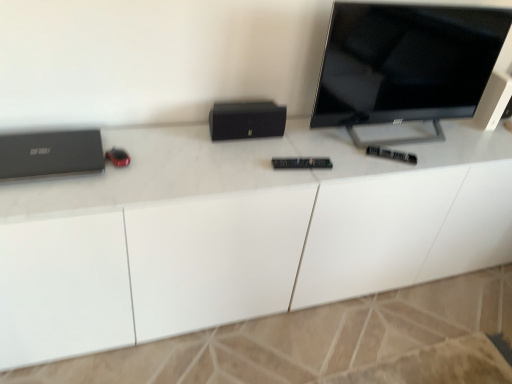
The image size is (512, 384). In order to click on vacant space situated on the left part of black matte speaker at upper right in this screenshot , I will do (449, 131).